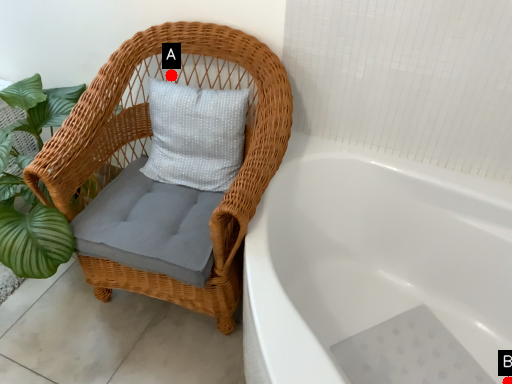
Question: Two points are circled on the image, labeled by A and B beside each circle. Which point is farther from the camera taking this photo?

Choices:
 (A) A is further
 (B) B is further

Answer: (A)